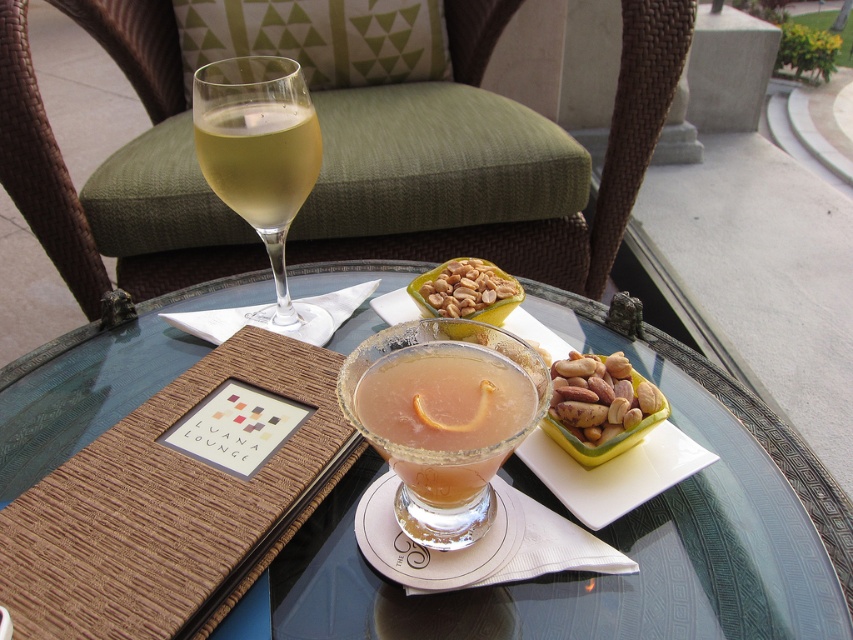
Does translucent glass cocktail at center have a smaller size compared to translucent glass wine glass at left?

Yes.

This screenshot has width=853, height=640. I want to click on translucent glass cocktail at center, so click(445, 442).

Does translucent glass wine glass at left appear over shiny brown nuts at center?

Yes.

Does translucent glass wine glass at left have a larger size compared to shiny brown nuts at center?

Yes, translucent glass wine glass at left is bigger than shiny brown nuts at center.

Where is `translucent glass wine glass at left`? The height and width of the screenshot is (640, 853). translucent glass wine glass at left is located at coordinates (260, 163).

This screenshot has width=853, height=640. In order to click on translucent glass wine glass at left in this screenshot , I will do `click(260, 163)`.

Where is `translucent glass wine glass at left`? translucent glass wine glass at left is located at coordinates (260, 163).